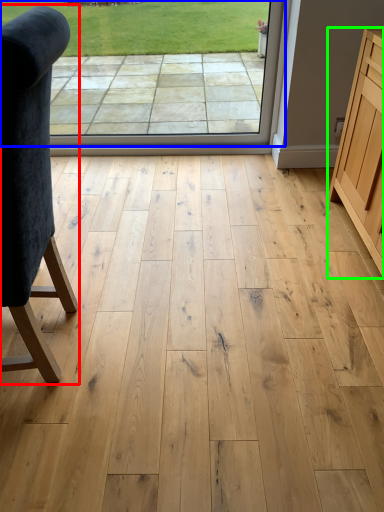
Question: Which object is the farthest from chair (highlighted by a red box)? Choose among these: window screen (highlighted by a blue box) or cabinetry (highlighted by a green box).

Choices:
 (A) window screen
 (B) cabinetry

Answer: (A)